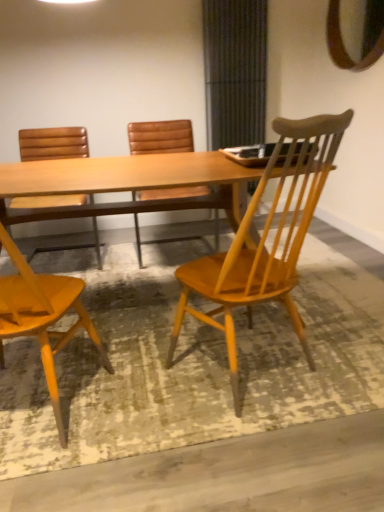
Question: From the image's perspective, does matte wood chair at left, the third chair viewed from the right, appear lower than wooden mirror at upper right?

Choices:
 (A) yes
 (B) no

Answer: (A)

Question: From the image's perspective, would you say matte wood chair at left, acting as the second chair starting from the left, is positioned over wooden mirror at upper right?

Choices:
 (A) no
 (B) yes

Answer: (A)

Question: Is matte wood chair at left, acting as the second chair starting from the left, smaller than wooden mirror at upper right?

Choices:
 (A) yes
 (B) no

Answer: (B)

Question: Can we say matte wood chair at left, the third chair viewed from the right, lies outside wooden mirror at upper right?

Choices:
 (A) yes
 (B) no

Answer: (A)

Question: Is matte wood chair at left, the third chair viewed from the right, aimed at wooden mirror at upper right?

Choices:
 (A) no
 (B) yes

Answer: (A)

Question: Considering the relative positions of matte wood chair at left, the third chair viewed from the right, and wooden mirror at upper right in the image provided, is matte wood chair at left, the third chair viewed from the right, to the right of wooden mirror at upper right from the viewer's perspective?

Choices:
 (A) yes
 (B) no

Answer: (B)

Question: Is matte wood chair at left, acting as the second chair starting from the left, positioned with its back to matte brown leather chair at left, the 1th chair from the left?

Choices:
 (A) no
 (B) yes

Answer: (A)

Question: Considering the relative sizes of matte wood chair at left, acting as the second chair starting from the left, and matte brown leather chair at left, which is counted as the fourth chair, starting from the right, in the image provided, is matte wood chair at left, acting as the second chair starting from the left, taller than matte brown leather chair at left, which is counted as the fourth chair, starting from the right,?

Choices:
 (A) no
 (B) yes

Answer: (B)

Question: From a real-world perspective, is matte wood chair at left, acting as the second chair starting from the left, physically above matte brown leather chair at left, the 1th chair from the left?

Choices:
 (A) no
 (B) yes

Answer: (B)

Question: Is the depth of matte wood chair at left, the third chair viewed from the right, less than that of matte brown leather chair at left, the 1th chair from the left?

Choices:
 (A) yes
 (B) no

Answer: (A)

Question: Considering the relative sizes of matte wood chair at left, acting as the second chair starting from the left, and matte brown leather chair at left, which is counted as the fourth chair, starting from the right, in the image provided, is matte wood chair at left, acting as the second chair starting from the left, wider than matte brown leather chair at left, which is counted as the fourth chair, starting from the right,?

Choices:
 (A) yes
 (B) no

Answer: (B)

Question: Does matte wood chair at left, acting as the second chair starting from the left, lie behind matte brown leather chair at left, the 1th chair from the left?

Choices:
 (A) yes
 (B) no

Answer: (B)

Question: Considering the relative sizes of wooden chair at center, arranged as the 4th chair when viewed from the left, and matte wood chair at left, acting as the second chair starting from the left, in the image provided, is wooden chair at center, arranged as the 4th chair when viewed from the left, smaller than matte wood chair at left, acting as the second chair starting from the left,?

Choices:
 (A) no
 (B) yes

Answer: (B)